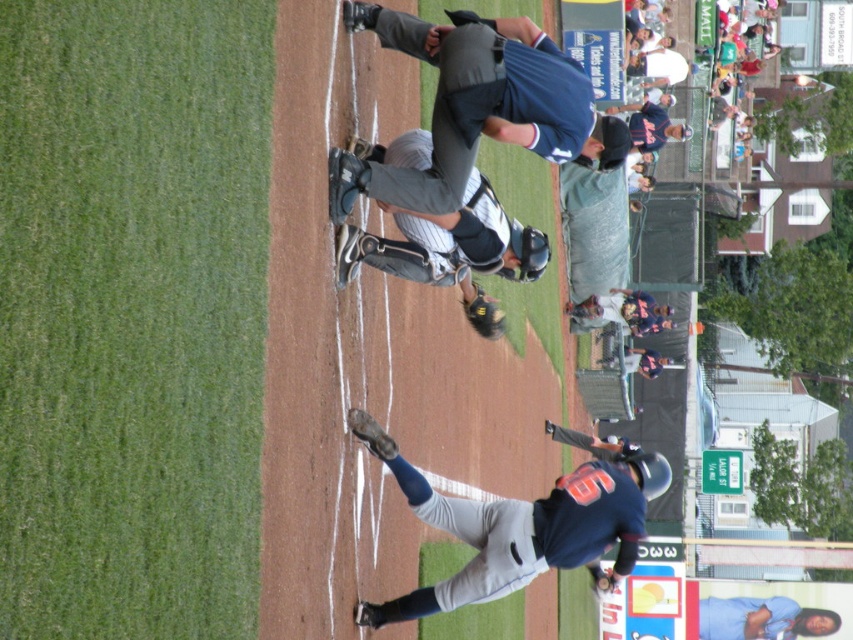
Question: Which point appears closest to the camera in this image?

Choices:
 (A) (473, 502)
 (B) (399, 51)
 (C) (401, 244)

Answer: (C)

Question: Based on their relative distances, which object is farther from the blue fabric baseball glove at center?

Choices:
 (A) dark blue jersey at center
 (B) gray fabric catcher at center
 (C) blue fabric shirt at lower right
 (D) dark brown leather glove at lower center

Answer: (C)

Question: Is blue fabric baseball glove at center smaller than dark brown leather glove at center?

Choices:
 (A) yes
 (B) no

Answer: (B)

Question: Is dark blue jersey at center behind dark brown leather glove at lower center?

Choices:
 (A) no
 (B) yes

Answer: (B)

Question: Is blue fabric baseball glove at center further to camera compared to blue fabric shirt at lower right?

Choices:
 (A) yes
 (B) no

Answer: (B)

Question: Which object appears farthest from the camera in this image?

Choices:
 (A) blue fabric baseball glove at center
 (B) gray fabric catcher at center
 (C) dark blue jersey at center
 (D) blue fabric shirt at lower right

Answer: (D)